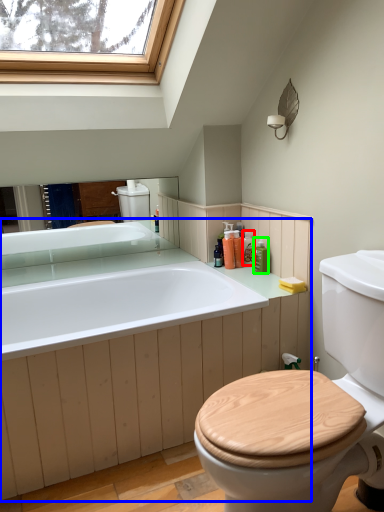
Question: Estimate the real-world distances between objects in this image. Which object is farther from toiletry (highlighted by a red box), counter top (highlighted by a blue box) or toiletry (highlighted by a green box)?

Choices:
 (A) counter top
 (B) toiletry

Answer: (A)